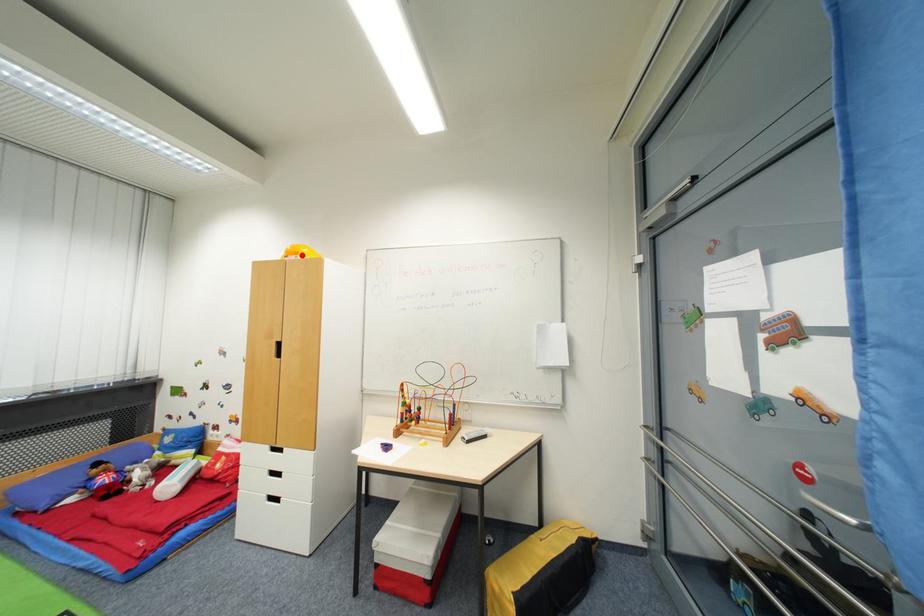
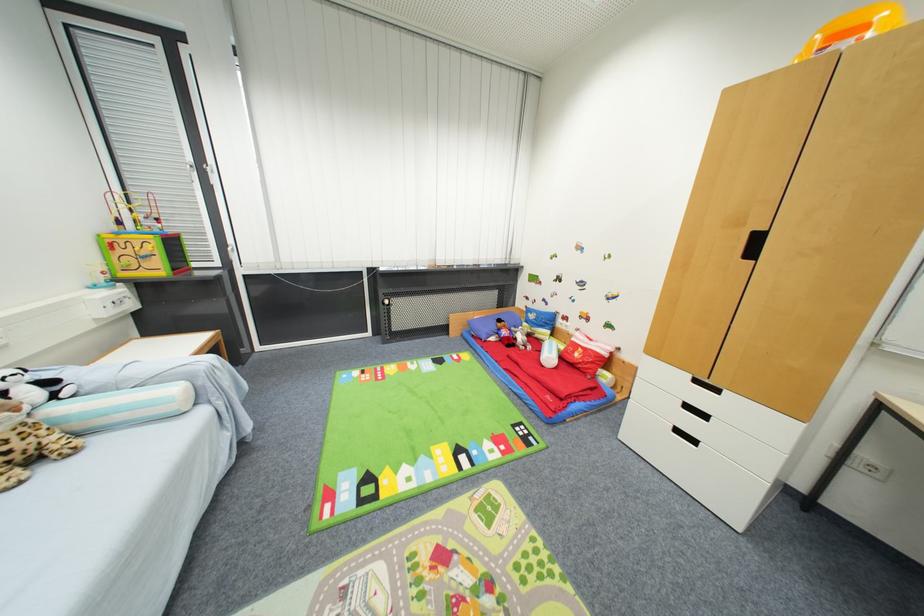
Question: I am providing you with two images of the same scene from different viewpoints. In image1, a red point is highlighted. Considering the same 3D point in image2, which of the following is correct?

Choices:
 (A) It is closer
 (B) It is farther

Answer: (B)